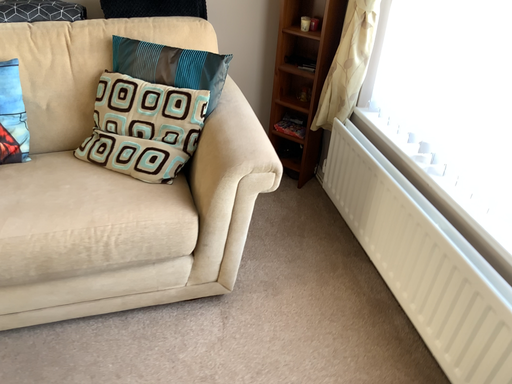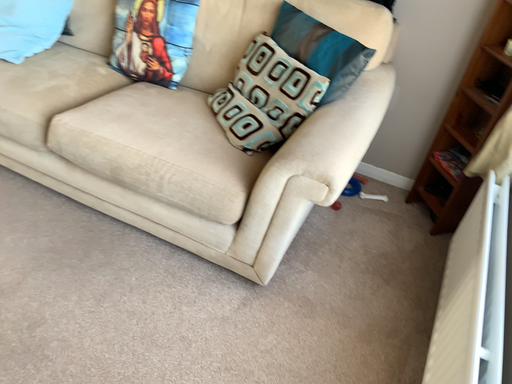
Question: How did the camera likely rotate when shooting the video?

Choices:
 (A) rotated right
 (B) rotated left

Answer: (B)